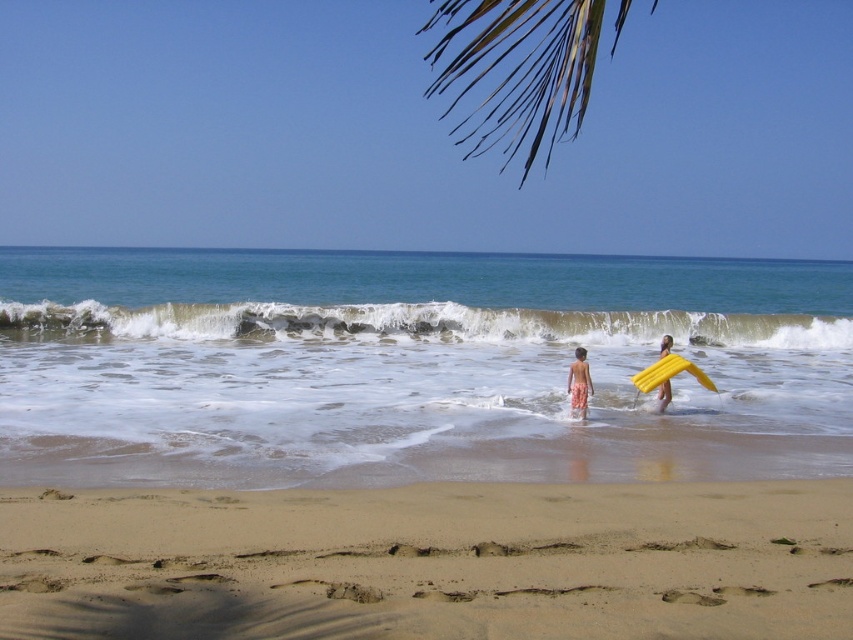
You are standing at the beach and see two points marked on the sand. The first point is at coordinate point(358, 268) and the second is at point(578, 406). Which point is closer to you?

Point(358, 268) is closer to you because it is further to the viewer than point(578, 406).

You are standing on the beach and see the yellow foam surfboard at right. Where exactly is it located in the image?

The yellow foam surfboard at right is located at point coordinates of (668, 372).